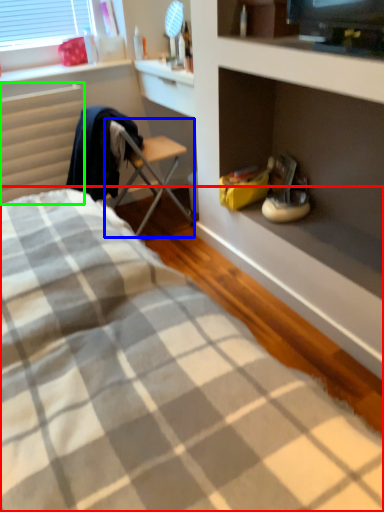
Question: Considering the real-world distances, which object is closest to bed (highlighted by a red box)? chair (highlighted by a blue box) or radiator (highlighted by a green box).

Choices:
 (A) chair
 (B) radiator

Answer: (B)